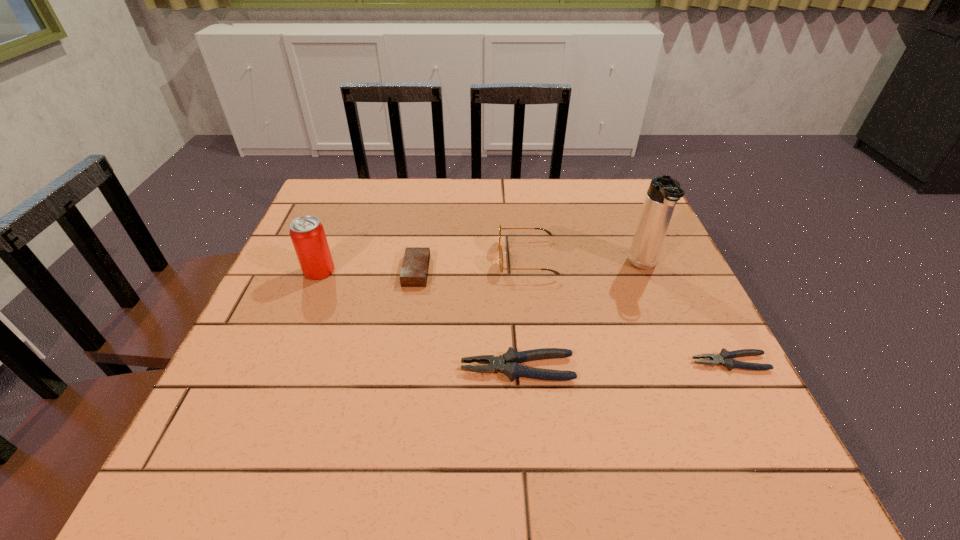
Where is `the left pliers`? The height and width of the screenshot is (540, 960). the left pliers is located at coordinates (508, 363).

What are the coordinates of `the right pliers` in the screenshot? It's located at (725, 358).

You are a GUI agent. You are given a task and a screenshot of the screen. Output one action in this format:
    pyautogui.click(x=<x>, y=<y>)
    Task: Click on the shortest object
    
    Given the screenshot: What is the action you would take?
    pyautogui.click(x=725, y=358)

Where is `the leftmost object`? The height and width of the screenshot is (540, 960). the leftmost object is located at coordinates (307, 234).

This screenshot has height=540, width=960. In order to click on can in this screenshot , I will do `click(307, 234)`.

Identify the location of the fourth shortest object. (548, 232).

Find the location of `the tallest object`. the tallest object is located at coordinates (664, 192).

This screenshot has height=540, width=960. I want to click on the second object from left to right, so click(x=414, y=272).

Find the location of a particular element. This screenshot has height=540, width=960. vacant area situated at the gripping part of the taller pliers is located at coordinates click(x=305, y=368).

This screenshot has height=540, width=960. I want to click on vacant space located at the gripping part of the taller pliers, so click(x=279, y=368).